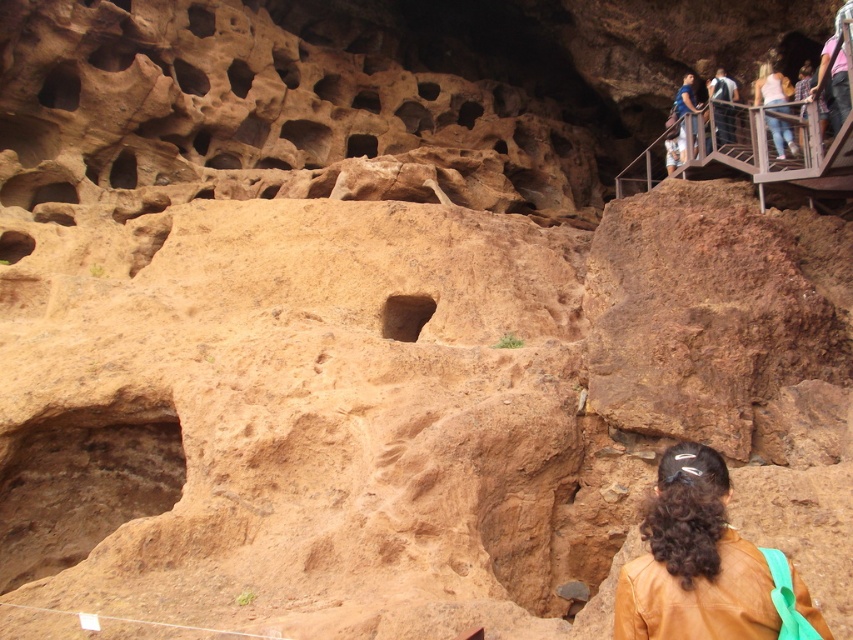
You are a geologist examining the rock formations and notice a pink fabric at upper right. Where exactly is the pink fabric located in relation to the rock formations?

The pink fabric at upper right is located at coordinates point (834, 72) relative to the image frame.

You are a photographer trying to capture a photo of the rocky landscape. You notice the brown leather jacket at lower right and the light blue denim jeans at upper right in your frame. Which item appears shorter in the photo?

The brown leather jacket at lower right appears shorter than the light blue denim jeans at upper right in the photo.

Looking at this image, you are a hiker trying to locate your dropped keys. You remember seeing them near the brown leather jacket at lower right. Based on the coordinates provided, can you confirm if the keys are at point (695, 561)?

Yes, the keys are at point (695, 561) because that is where the brown leather jacket at lower right is located.